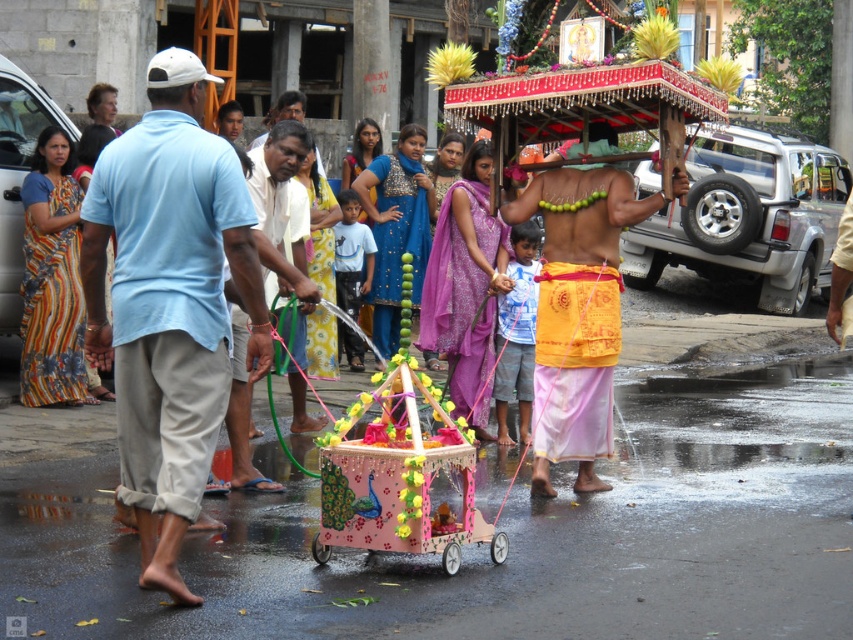
Question: Is light blue cotton shirt at left thinner than yellow fabric cloth at center?

Choices:
 (A) no
 (B) yes

Answer: (B)

Question: Can you confirm if light blue cotton shirt at left is positioned below yellow fabric cloth at center?

Choices:
 (A) yes
 (B) no

Answer: (A)

Question: Does yellow fabric cloth at center appear on the left side of pastel pink wooden cart at center?

Choices:
 (A) yes
 (B) no

Answer: (B)

Question: Which is nearer to the light blue cotton shirt at left?

Choices:
 (A) pastel pink wooden cart at center
 (B) yellow fabric cloth at center

Answer: (A)

Question: Which point is farther to the camera?

Choices:
 (A) (154, 74)
 (B) (386, 486)
 (C) (599, 305)

Answer: (C)

Question: Estimate the real-world distances between objects in this image. Which object is farther from the light blue cotton shirt at left?

Choices:
 (A) yellow fabric cloth at center
 (B) pastel pink wooden cart at center

Answer: (A)